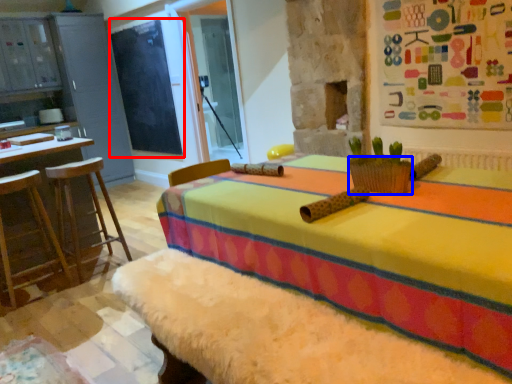
Question: Among these objects, which one is nearest to the camera, bulletin board (highlighted by a red box) or basket (highlighted by a blue box)?

Choices:
 (A) bulletin board
 (B) basket

Answer: (B)